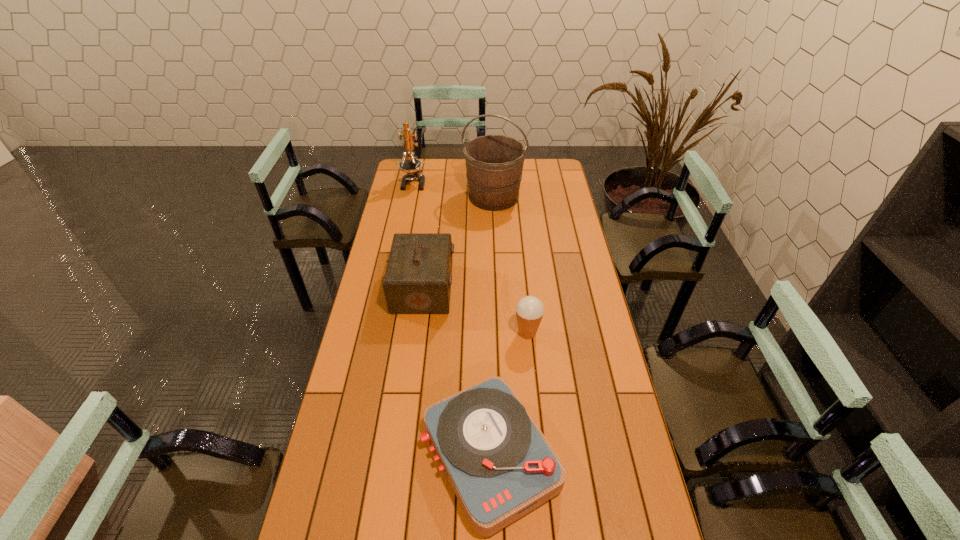
Locate an element on the screen. vacant area at the right edge of the desktop is located at coordinates (564, 221).

In order to click on free space at the far right corner of the desktop in this screenshot , I will do [541, 179].

Find the location of a particular element. The height and width of the screenshot is (540, 960). empty space that is in between the fourth shortest object and the bucket is located at coordinates (453, 190).

The height and width of the screenshot is (540, 960). I want to click on vacant area that lies between the first-aid kit and the fourth farthest object, so click(475, 310).

The height and width of the screenshot is (540, 960). Identify the location of empty location between the microscope and the icecream. (470, 258).

Locate an element on the screen. free space between the fourth farthest object and the microscope is located at coordinates (470, 258).

You are a GUI agent. You are given a task and a screenshot of the screen. Output one action in this format:
    pyautogui.click(x=<x>, y=<y>)
    Task: Click on the free spot between the first-aid kit and the bucket
    This screenshot has height=540, width=960.
    Given the screenshot: What is the action you would take?
    pyautogui.click(x=458, y=242)

Locate an element on the screen. vacant space in between the second shortest object and the second tallest object is located at coordinates 470,258.

I want to click on free area in between the fourth tallest object and the tallest object, so click(511, 265).

This screenshot has width=960, height=540. Identify the location of free area in between the second nearest object and the bucket. (511, 265).